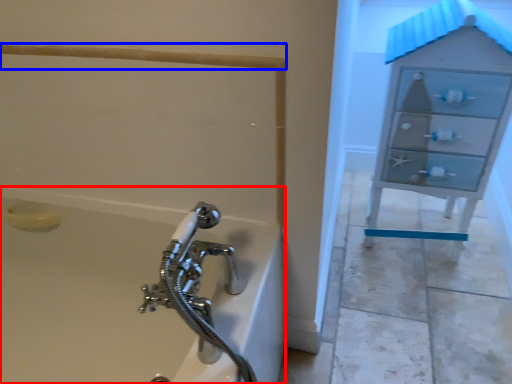
Question: Which object is further to the camera taking this photo, bathtub (highlighted by a red box) or rail (highlighted by a blue box)?

Choices:
 (A) bathtub
 (B) rail

Answer: (B)